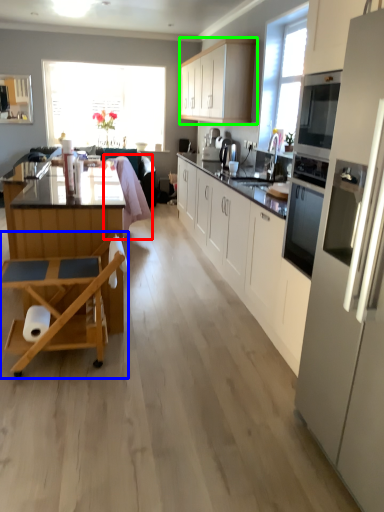
Question: Which object is the farthest from swivel chair (highlighted by a red box)? Choose among these: table (highlighted by a blue box) or cabinetry (highlighted by a green box).

Choices:
 (A) table
 (B) cabinetry

Answer: (A)